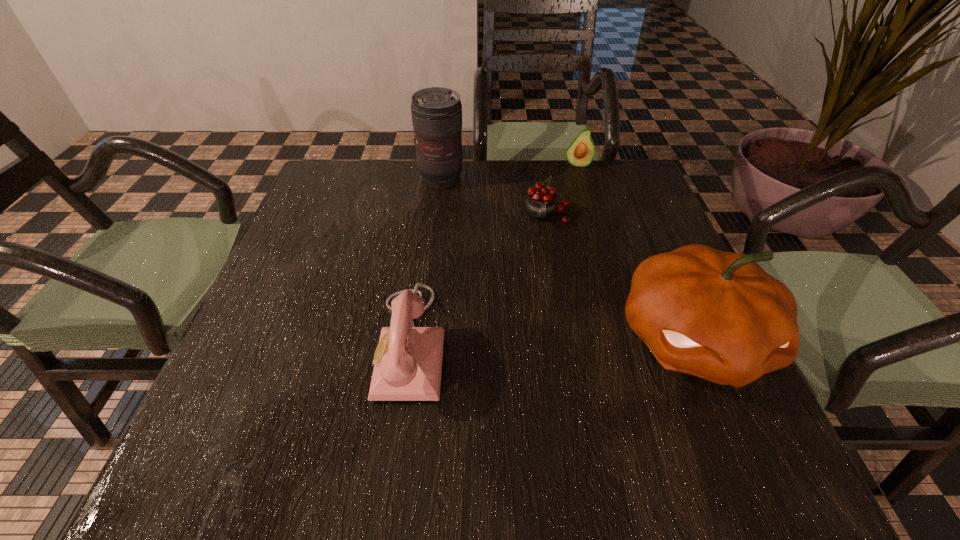
Identify the location of vacant space located on the handle side of the third object from right to left. Image resolution: width=960 pixels, height=540 pixels. (552, 267).

Where is `free location located on the handle side of the third object from right to left`? free location located on the handle side of the third object from right to left is located at coordinates (554, 282).

This screenshot has height=540, width=960. I want to click on vacant region located 0.080m on the cut side of the avocado, so click(579, 185).

Locate an element on the screen. The width and height of the screenshot is (960, 540). vacant space positioned 0.190m on the cut side of the avocado is located at coordinates (581, 208).

Find the location of a particular element. vacant space situated on the cut side of the avocado is located at coordinates pyautogui.click(x=581, y=215).

The width and height of the screenshot is (960, 540). What are the coordinates of `vacant point located 0.230m on the side of the telephoto lens where the control switches are located` in the screenshot? It's located at (489, 240).

Identify the location of free point located on the side of the telephoto lens where the control switches are located. (485, 235).

The image size is (960, 540). In order to click on free space located on the side of the telephoto lens where the control switches are located in this screenshot , I will do `click(491, 242)`.

Image resolution: width=960 pixels, height=540 pixels. What are the coordinates of `pot filled with cherries located in the far edge section of the desktop` in the screenshot? It's located at (540, 204).

Identify the location of avocado situated at the far edge. (580, 153).